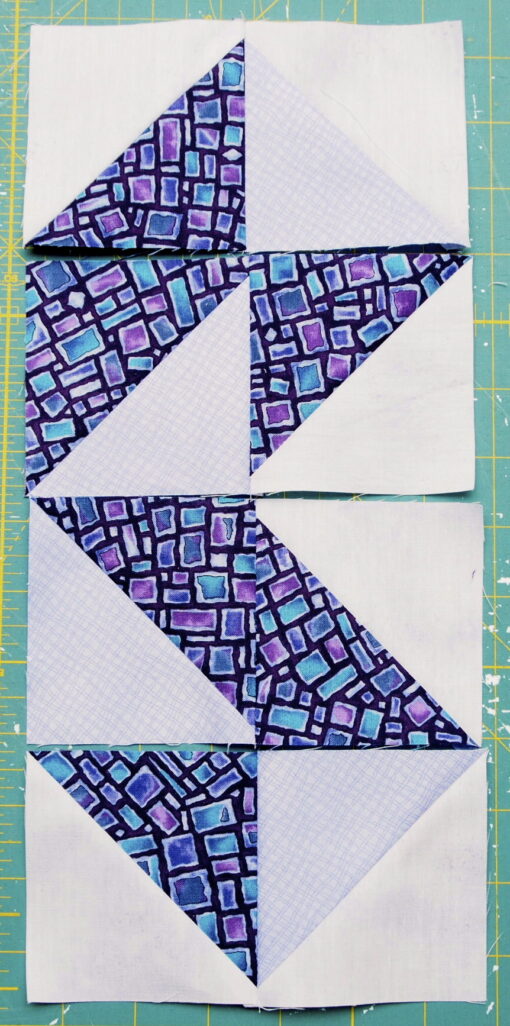
Image resolution: width=510 pixels, height=1026 pixels. In order to click on craft mat in this screenshot , I will do `click(489, 82)`.